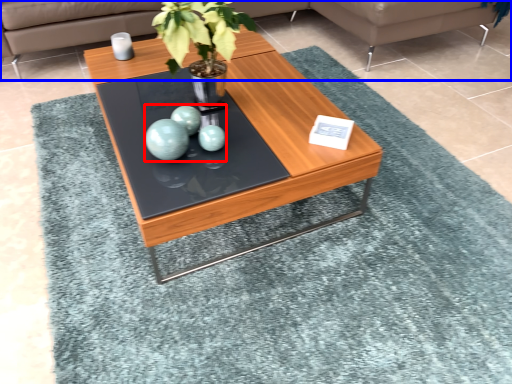
Question: Which object is closer to the camera taking this photo, teal (highlighted by a red box) or studio couch (highlighted by a blue box)?

Choices:
 (A) teal
 (B) studio couch

Answer: (A)